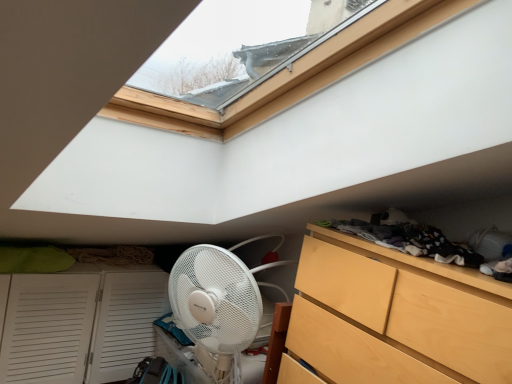
Question: From a real-world perspective, is dark gray fabric at upper right located higher than light wood dresser at lower right?

Choices:
 (A) no
 (B) yes

Answer: (B)

Question: Could you tell me if dark gray fabric at upper right is turned towards light wood dresser at lower right?

Choices:
 (A) yes
 (B) no

Answer: (B)

Question: Is dark gray fabric at upper right bigger than light wood dresser at lower right?

Choices:
 (A) no
 (B) yes

Answer: (A)

Question: Is dark gray fabric at upper right closer to camera compared to light wood dresser at lower right?

Choices:
 (A) yes
 (B) no

Answer: (B)

Question: Is dark gray fabric at upper right shorter than light wood dresser at lower right?

Choices:
 (A) yes
 (B) no

Answer: (A)

Question: Visually, is white louvered cupboard at lower left positioned to the left or to the right of light wood dresser at lower right?

Choices:
 (A) right
 (B) left

Answer: (B)

Question: From a real-world perspective, is white louvered cupboard at lower left above or below light wood dresser at lower right?

Choices:
 (A) above
 (B) below

Answer: (B)

Question: Would you say white louvered cupboard at lower left is inside or outside light wood dresser at lower right?

Choices:
 (A) inside
 (B) outside

Answer: (B)

Question: Based on their sizes in the image, would you say white louvered cupboard at lower left is bigger or smaller than light wood dresser at lower right?

Choices:
 (A) small
 (B) big

Answer: (B)

Question: Is point (436, 256) closer or farther from the camera than point (318, 271)?

Choices:
 (A) farther
 (B) closer

Answer: (B)

Question: Considering their positions, is dark gray fabric at upper right located in front of or behind light wood dresser at lower right?

Choices:
 (A) behind
 (B) front

Answer: (A)

Question: From the image's perspective, relative to light wood dresser at lower right, is dark gray fabric at upper right above or below?

Choices:
 (A) above
 (B) below

Answer: (A)

Question: From a real-world perspective, is dark gray fabric at upper right positioned above or below light wood dresser at lower right?

Choices:
 (A) above
 (B) below

Answer: (A)

Question: Is dark gray fabric at upper right inside the boundaries of white louvered cupboard at lower left, or outside?

Choices:
 (A) inside
 (B) outside

Answer: (B)

Question: Based on their sizes in the image, would you say dark gray fabric at upper right is bigger or smaller than white louvered cupboard at lower left?

Choices:
 (A) big
 (B) small

Answer: (B)